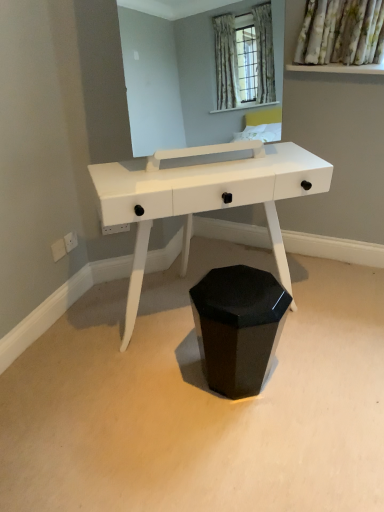
Where is `free spot in front of white glossy table at center`? free spot in front of white glossy table at center is located at coordinates (215, 435).